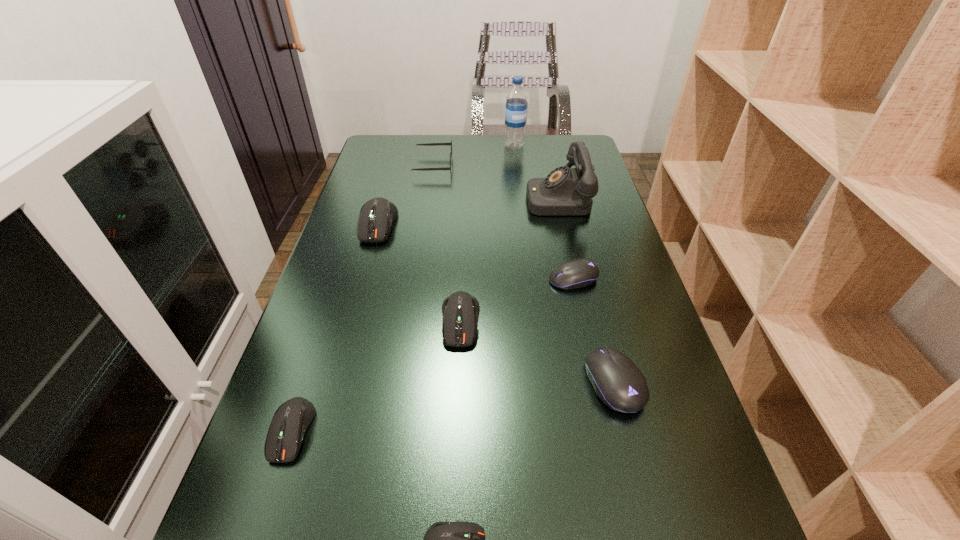
This screenshot has height=540, width=960. I want to click on the farthest object, so click(x=516, y=101).

This screenshot has width=960, height=540. In order to click on water bottle in this screenshot , I will do `click(516, 101)`.

At what (x,y) coordinates should I click in order to perform the action: click on gray telephone. Please return your answer as a coordinate pair (x, y). Looking at the image, I should click on (565, 191).

Where is `telephone`? Image resolution: width=960 pixels, height=540 pixels. telephone is located at coordinates (565, 191).

Locate an element on the screen. This screenshot has width=960, height=540. the seventh object from right to left is located at coordinates (427, 144).

Find the location of a particular element. sunglasses is located at coordinates (427, 144).

You are a GUI agent. You are given a task and a screenshot of the screen. Output one action in this format:
    pyautogui.click(x=<x>, y=<y>)
    Task: Click on the biggest dark computer equipment
    The image size is (960, 540).
    Given the screenshot: What is the action you would take?
    pyautogui.click(x=376, y=216)

Locate an element on the screen. The height and width of the screenshot is (540, 960). the tallest computer equipment is located at coordinates (376, 216).

Where is `the fourth nearest object`? This screenshot has width=960, height=540. the fourth nearest object is located at coordinates (460, 310).

Image resolution: width=960 pixels, height=540 pixels. I want to click on the third farthest computer equipment, so click(460, 310).